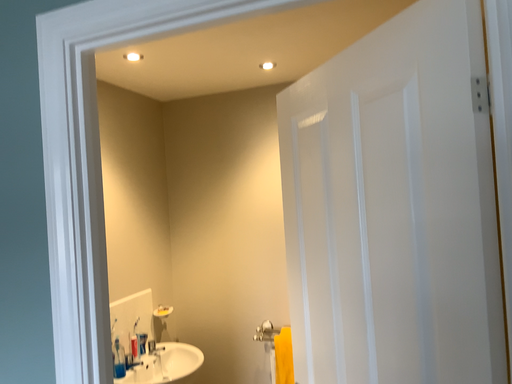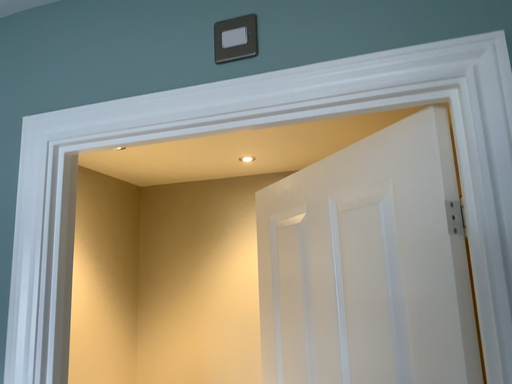
Question: Which way did the camera rotate in the video?

Choices:
 (A) rotated upward
 (B) rotated downward

Answer: (A)